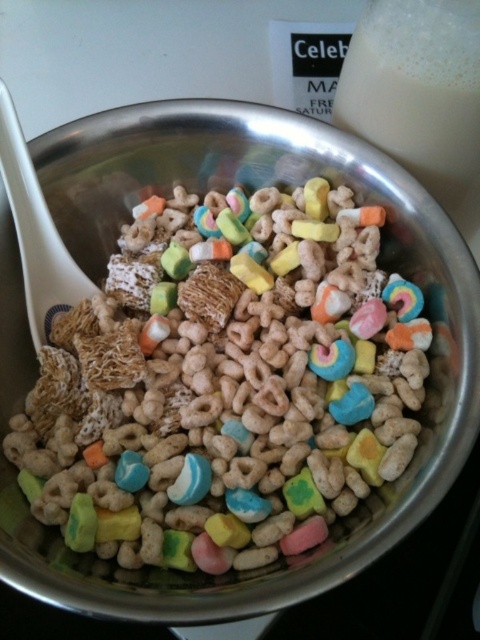
Question: Is the position of colorful cereal at center less distant than that of white frothy milk at upper right?

Choices:
 (A) yes
 (B) no

Answer: (A)

Question: Does colorful cereal at center lie in front of white plastic spoon at left?

Choices:
 (A) no
 (B) yes

Answer: (B)

Question: Which object appears farthest from the camera in this image?

Choices:
 (A) white plastic spoon at left
 (B) white frothy milk at upper right
 (C) colorful cereal at center

Answer: (A)

Question: Which point appears farthest from the camera in this image?

Choices:
 (A) [x=379, y=4]
 (B) [x=41, y=308]

Answer: (B)

Question: Can you confirm if colorful cereal at center is smaller than white plastic spoon at left?

Choices:
 (A) no
 (B) yes

Answer: (A)

Question: Among these points, which one is farthest from the camera?

Choices:
 (A) (369, 413)
 (B) (424, 35)

Answer: (A)